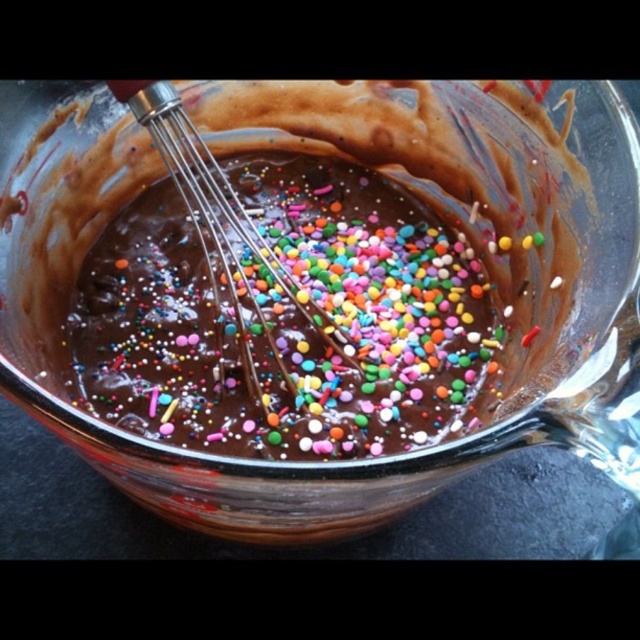
Question: Can you confirm if transparent glass bowl at center is bigger than metallic whisk at center?

Choices:
 (A) no
 (B) yes

Answer: (B)

Question: Which point is closer to the camera?

Choices:
 (A) (198, 515)
 (B) (291, 308)
 (C) (161, 148)

Answer: (A)

Question: Which point is farther to the camera?

Choices:
 (A) (131, 106)
 (B) (618, 221)

Answer: (A)

Question: Observing the image, what is the correct spatial positioning of chocolatesmoothbowl at center in reference to metallic whisk at center?

Choices:
 (A) left
 (B) right

Answer: (B)

Question: Which is nearer to the metallic whisk at center?

Choices:
 (A) chocolatesmoothbowl at center
 (B) transparent glass bowl at center

Answer: (A)

Question: Does chocolatesmoothbowl at center lie behind metallic whisk at center?

Choices:
 (A) no
 (B) yes

Answer: (B)